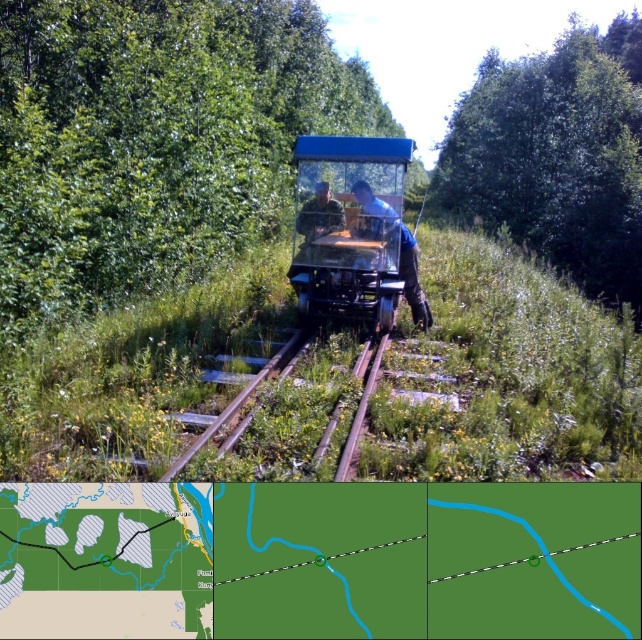
You are a hiker who wants to take a photo of the camouflage fabric man at center and the green leafy tree at upper center. Which object should you focus on first if you want to capture both in one shot without moving your camera?

The green leafy tree at upper center is taller than the camouflage fabric man at center, so you should focus on the green leafy tree at upper center first to ensure both are in frame.

You are a maintenance worker on the inspection cart and need to reach a specific point along the railway track. The two points you need to visit are point (489, 124) and point (401, 276). According to the scene, which point should you visit first if you are moving forward along the tracks?

You should visit point (401, 276) first because point (489, 124) is behind it, meaning it is further along the track in the direction of travel.